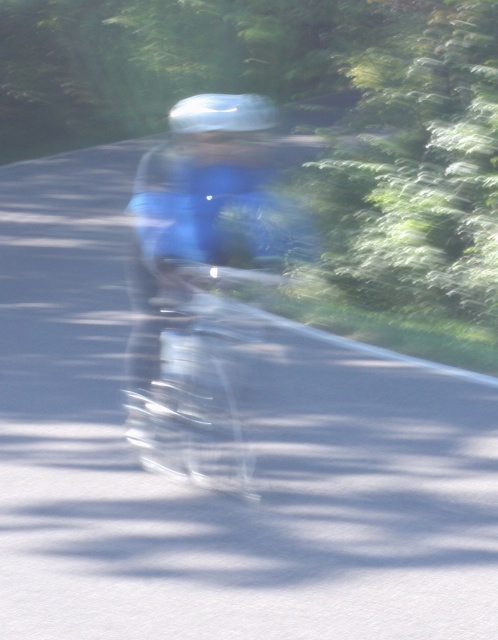
Question: Does clear plastic bicycle at center appear on the left side of shiny silver helmet at center?

Choices:
 (A) yes
 (B) no

Answer: (B)

Question: Does clear plastic bicycle at center have a greater width compared to shiny silver helmet at center?

Choices:
 (A) no
 (B) yes

Answer: (A)

Question: Which of the following is the closest to the observer?

Choices:
 (A) (243, 120)
 (B) (131, 387)

Answer: (A)

Question: In this image, where is clear plastic bicycle at center located relative to shiny silver helmet at center?

Choices:
 (A) above
 (B) below

Answer: (B)